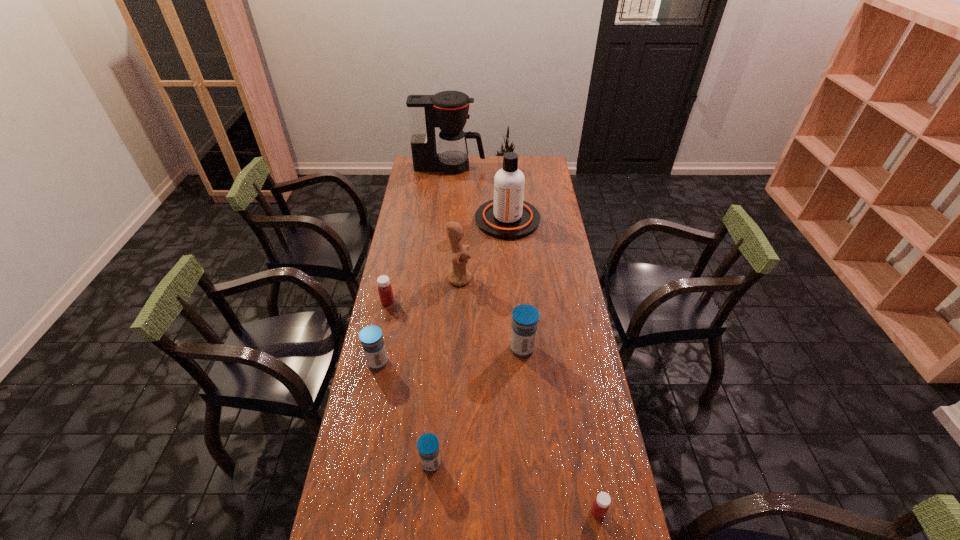
Locate an element on the screen. The image size is (960, 540). vacant space located 0.390m on the right of the farthest medicine is located at coordinates (495, 301).

Locate an element on the screen. The width and height of the screenshot is (960, 540). vacant space located on the back of the third medicine from right to left is located at coordinates (437, 397).

The height and width of the screenshot is (540, 960). What are the coordinates of `vacant space located on the back of the rightmost object` in the screenshot? It's located at (578, 403).

Locate an element on the screen. This screenshot has height=540, width=960. object that is at the far edge is located at coordinates (448, 110).

At what (x,y) coordinates should I click in order to perform the action: click on coffee maker positioned at the left edge. Please return your answer as a coordinate pair (x, y). Looking at the image, I should click on (x=448, y=110).

Where is `cleansing agent positioned at the right edge`? cleansing agent positioned at the right edge is located at coordinates (508, 217).

Identify the location of medicine located at the right edge. (600, 506).

Image resolution: width=960 pixels, height=540 pixels. Find the location of `object present at the far left corner`. object present at the far left corner is located at coordinates (448, 110).

Locate an element on the screen. vacant area at the left edge is located at coordinates (385, 505).

Locate an element on the screen. Image resolution: width=960 pixels, height=540 pixels. free space at the right edge of the desktop is located at coordinates (559, 347).